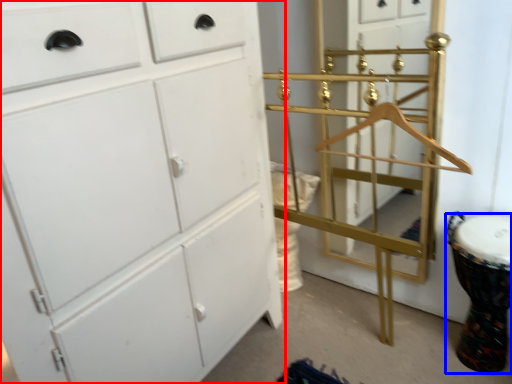
Question: Which object is closer to the camera taking this photo, chest of drawers (highlighted by a red box) or drum (highlighted by a blue box)?

Choices:
 (A) chest of drawers
 (B) drum

Answer: (A)